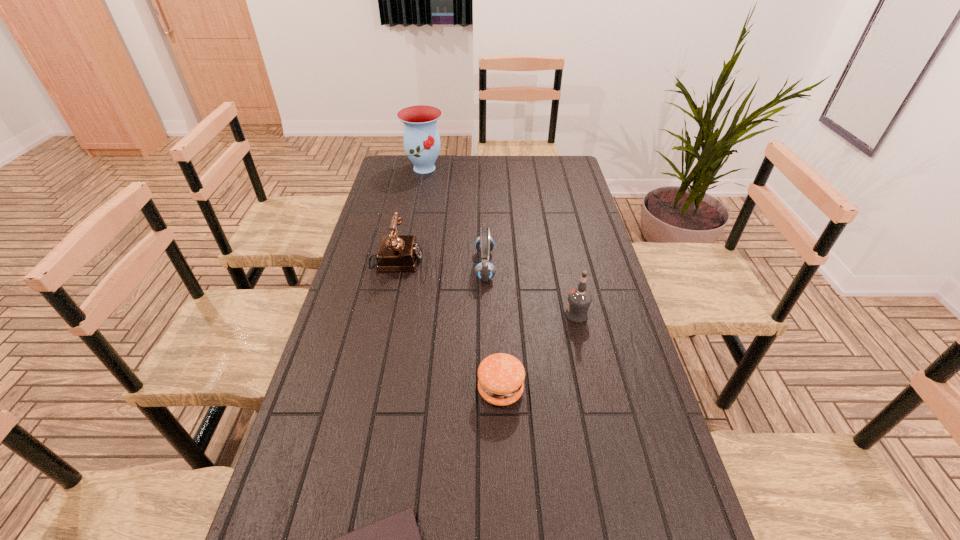
You are a GUI agent. You are given a task and a screenshot of the screen. Output one action in this format:
    pyautogui.click(x=<x>, y=<y>)
    Task: Click on the vacant region that satisfies the following two spatial constraints: 1. on the front side of the second shortest object; 2. on the right side of the farthest object
    
    Given the screenshot: What is the action you would take?
    pyautogui.click(x=382, y=390)

Identify the location of vacant space that satisfies the following two spatial constraints: 1. on the dial of the fifth tallest object; 2. on the right side of the telephone. (368, 390).